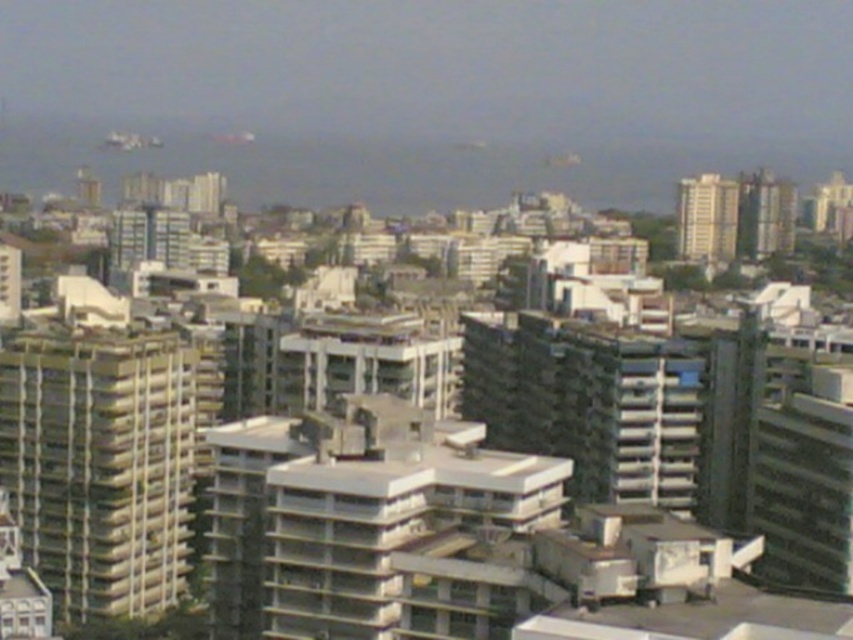
Is beige concrete building at left to the right of smooth beige building at upper right from the viewer's perspective?

In fact, beige concrete building at left is to the left of smooth beige building at upper right.

Is beige concrete building at left positioned at the back of smooth beige building at upper right?

No, it is not.

Is point (135, 513) farther from viewer compared to point (741, 221)?

No, (135, 513) is in front of (741, 221).

Locate an element on the screen. This screenshot has width=853, height=640. beige concrete building at left is located at coordinates (100, 465).

Based on the photo, is beige concrete building at center shorter than smooth beige building at upper right?

Yes.

Is point (677, 230) farther from viewer compared to point (759, 224)?

Yes.

Which is behind, point (709, 180) or point (757, 227)?

Point (757, 227)

I want to click on beige concrete building at center, so click(x=706, y=218).

Can you confirm if beige concrete building at left is shorter than beige concrete building at center?

No, beige concrete building at left is not shorter than beige concrete building at center.

Which is more to the right, beige concrete building at left or beige concrete building at center?

Positioned to the right is beige concrete building at center.

At what (x,y) coordinates should I click in order to perform the action: click on beige concrete building at left. Please return your answer as a coordinate pair (x, y). Looking at the image, I should click on (100, 465).